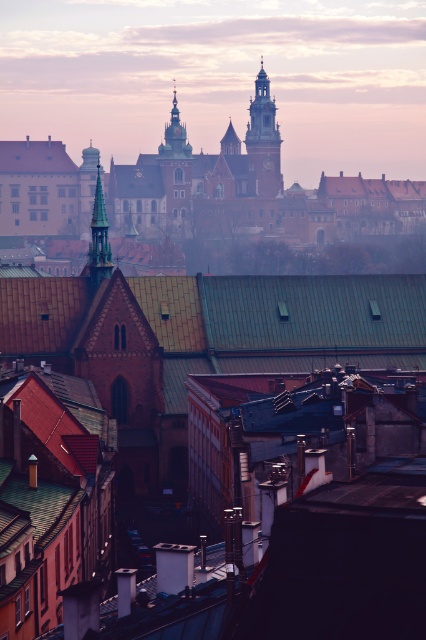
You are an architect analyzing the cityscape. You notice the brick tower at center and the smooth green spire at center. Which structure is positioned farther away from your viewpoint?

The smooth green spire at center is positioned farther away from your viewpoint because it is located behind the brick tower at center.